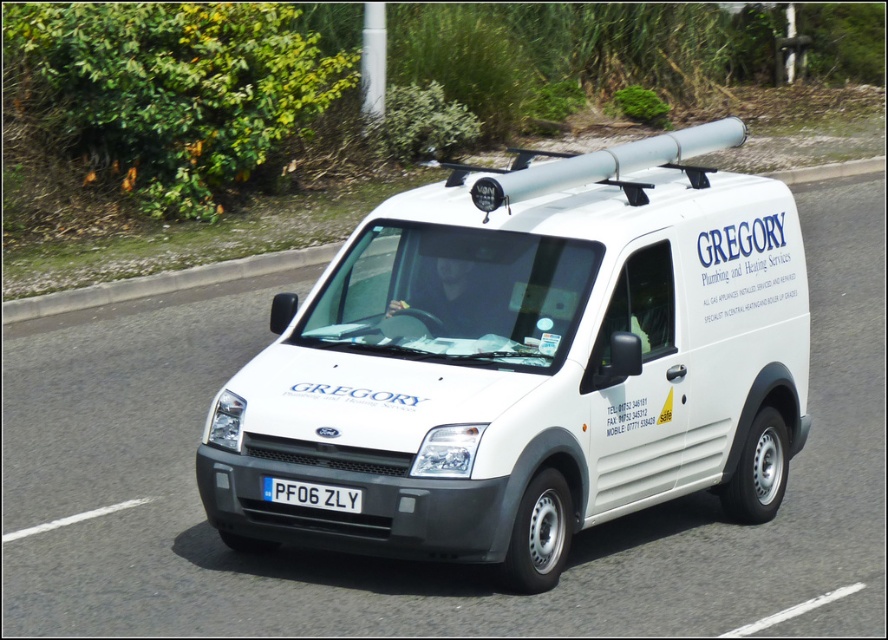
Is white concrete curb at center shorter than white plastic license plate at center?

Incorrect, white concrete curb at center's height does not fall short of white plastic license plate at center's.

Which is above, white concrete curb at center or white plastic license plate at center?

Positioned higher is white concrete curb at center.

Does point (196, 276) come behind point (308, 490)?

Yes, point (196, 276) is farther from viewer.

Where is `white concrete curb at center`? white concrete curb at center is located at coordinates (163, 282).

Does white matte van at center appear under white concrete curb at center?

Correct, white matte van at center is located below white concrete curb at center.

Consider the image. Is white matte van at center thinner than white concrete curb at center?

Yes, white matte van at center is thinner than white concrete curb at center.

Which is behind, point (644, 252) or point (251, 275)?

Point (251, 275)

At what (x,y) coordinates should I click in order to perform the action: click on white matte van at center. Please return your answer as a coordinate pair (x, y). The width and height of the screenshot is (888, 640). Looking at the image, I should click on [528, 362].

Does white matte van at center have a greater width compared to white plastic license plate at center?

Correct, the width of white matte van at center exceeds that of white plastic license plate at center.

Image resolution: width=888 pixels, height=640 pixels. What do you see at coordinates (528, 362) in the screenshot?
I see `white matte van at center` at bounding box center [528, 362].

This screenshot has width=888, height=640. Describe the element at coordinates (528, 362) in the screenshot. I see `white matte van at center` at that location.

The width and height of the screenshot is (888, 640). I want to click on white matte van at center, so click(528, 362).